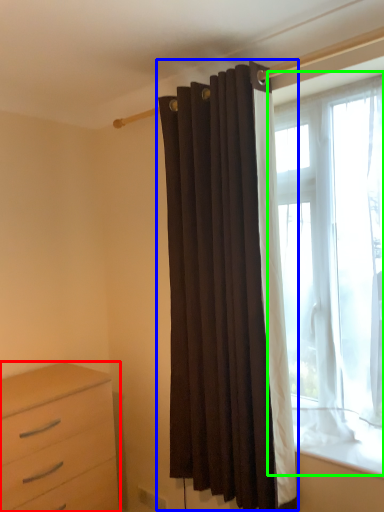
Question: Considering the real-world distances, which object is closest to chest of drawers (highlighted by a red box)? curtain (highlighted by a blue box) or window (highlighted by a green box).

Choices:
 (A) curtain
 (B) window

Answer: (A)